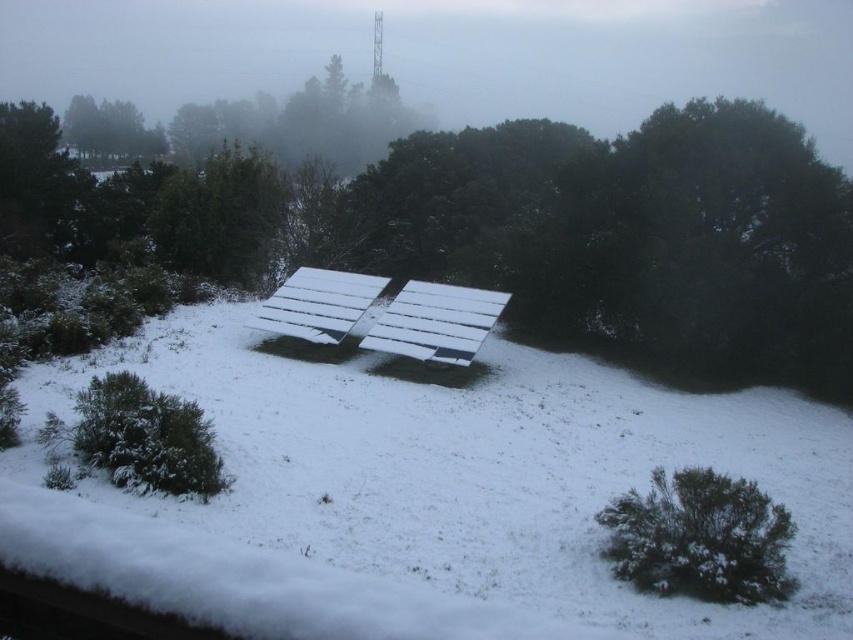
Is white matte solar panel at center to the left of green bush at lower right from the viewer's perspective?

Indeed, white matte solar panel at center is positioned on the left side of green bush at lower right.

Between point (529, 499) and point (746, 602), which one is positioned behind?

Positioned behind is point (529, 499).

Find the location of a particular element. This screenshot has width=853, height=640. white matte solar panel at center is located at coordinates (424, 496).

Which is more to the right, white matte solar panel at center or green matte tree at upper left?

white matte solar panel at center is more to the right.

Is white matte solar panel at center thinner than green matte tree at upper left?

In fact, white matte solar panel at center might be wider than green matte tree at upper left.

Which is behind, point (811, 512) or point (109, 152)?

The point (109, 152) is more distant.

Locate an element on the screen. This screenshot has width=853, height=640. white matte solar panel at center is located at coordinates (424, 496).

Which is more to the right, white matte solar panel at center or white wooden bench at center?

white matte solar panel at center is more to the right.

Which is in front, point (849, 483) or point (349, 305)?

Point (849, 483)

You are a GUI agent. You are given a task and a screenshot of the screen. Output one action in this format:
    pyautogui.click(x=<x>, y=<y>)
    Task: Click on the white matte solar panel at center
    The width and height of the screenshot is (853, 640).
    Given the screenshot: What is the action you would take?
    pyautogui.click(x=424, y=496)